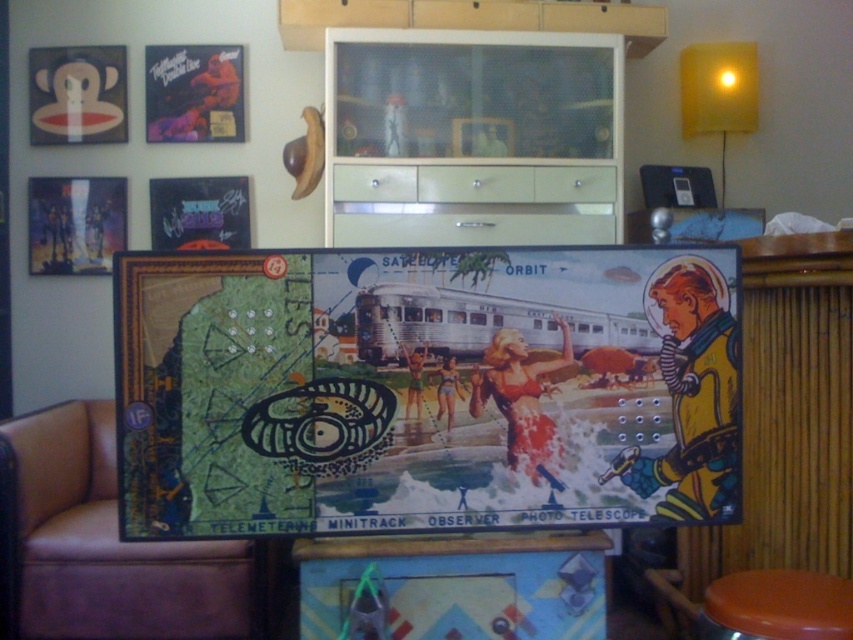
You are standing in the living room and see two points marked on the floor. The first point is at coordinates point (431, 298) and the second point is at point (76, 586). If you want to walk from the first point to the second point, which direction should you move relative to the large colorful board game box placed in the foreground?

Since point (431, 298) is in front of point (76, 586), you should move backward away from the board game box to reach the second point.

Looking at this image, you are a guest entering the room and want to sit down. Which object, the brown leather couch at lower left or the metallic silver poster at upper left, is more suitable for sitting?

The brown leather couch at lower left is more suitable for sitting because it has a greater height compared to the metallic silver poster at upper left, which is likely hanging on the wall and not meant for sitting.